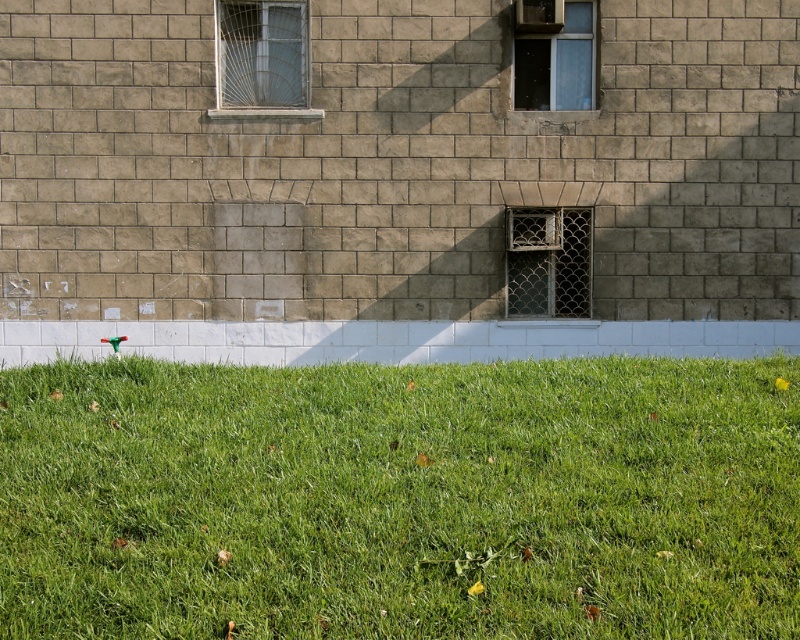
Which is more to the right, metallic grid window at upper left or clear glass window at upper center?

From the viewer's perspective, clear glass window at upper center appears more on the right side.

Does metallic grid window at upper left appear on the left side of clear glass window at upper center?

Correct, you'll find metallic grid window at upper left to the left of clear glass window at upper center.

Locate an element on the screen. The height and width of the screenshot is (640, 800). metallic grid window at upper left is located at coordinates (262, 60).

Who is positioned more to the left, rusty metal grate at center or clear glass window at upper center?

rusty metal grate at center

Is rusty metal grate at center taller than clear glass window at upper center?

Yes, rusty metal grate at center is taller than clear glass window at upper center.

Between point (529, 252) and point (588, 83), which one is positioned behind?

Positioned behind is point (588, 83).

Where is `rusty metal grate at center`? Image resolution: width=800 pixels, height=640 pixels. rusty metal grate at center is located at coordinates (548, 262).

Can you confirm if green grass at lower center is smaller than clear glass window at upper center?

Incorrect, green grass at lower center is not smaller in size than clear glass window at upper center.

Who is more distant from viewer, (x=184, y=580) or (x=533, y=68)?

The point (x=533, y=68) is more distant.

Describe the element at coordinates (400, 499) in the screenshot. The width and height of the screenshot is (800, 640). I see `green grass at lower center` at that location.

Where is `green grass at lower center`? The image size is (800, 640). green grass at lower center is located at coordinates (400, 499).